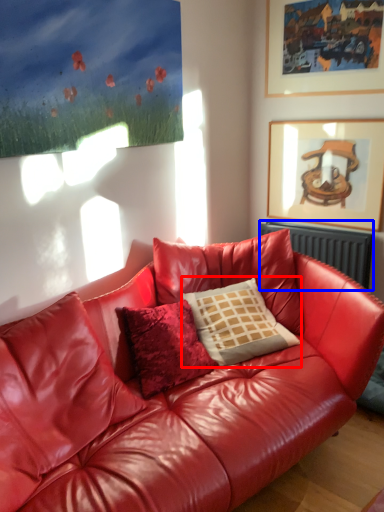
Question: Among these objects, which one is nearest to the camera, pillow (highlighted by a red box) or radiator (highlighted by a blue box)?

Choices:
 (A) pillow
 (B) radiator

Answer: (A)